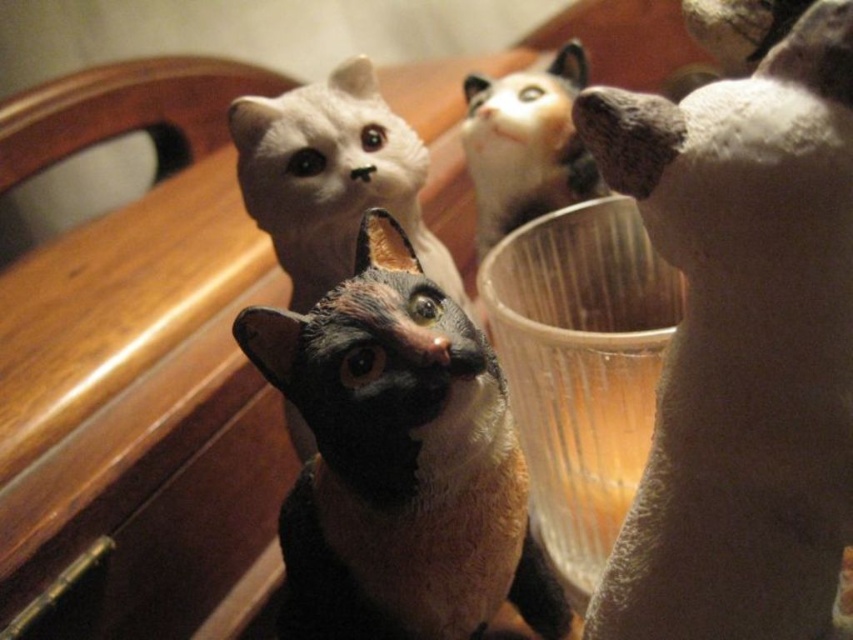
In the scene shown: You are organizing a display of cat figurines on a shelf. You have a white plush cat at upper right and a matte white cat at upper center. Which one is taller?

The white plush cat at upper right is taller than the matte white cat at upper center according to the description.

You are organizing a display of cat figurines on a table. You have a black and white cat figurine at the front and two white cats behind it. The white plush cat at upper right and the white fur cat at upper right are both in the back. Which of the two white cats is positioned lower on the table?

The white plush cat at upper right is positioned lower on the table since it is located below the white fur cat at upper right.

You are standing in front of the wooden surface with the cat figurines. You want to reach for the figurine at point (300, 198) first. Is this figurine closer to you than the one at point (581, 161)?

Yes, the figurine at point (300, 198) is closer to you because it is in front of the figurine at point (581, 161) according to their positions on the wooden surface.